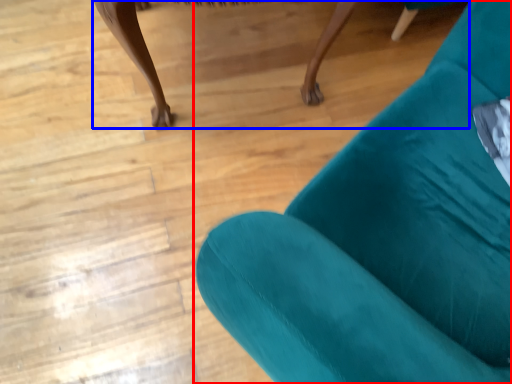
Question: Which point is further to the camera, chair (highlighted by a red box) or furniture (highlighted by a blue box)?

Choices:
 (A) chair
 (B) furniture

Answer: (B)